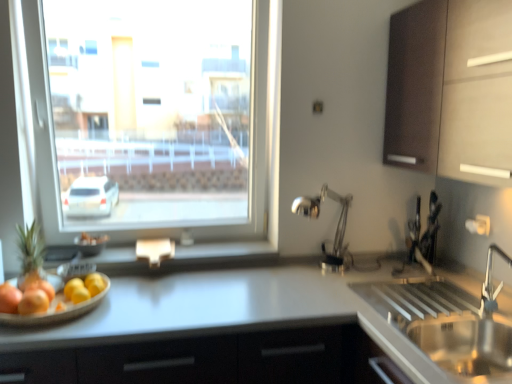
Locate an element on the screen. This screenshot has height=384, width=512. free space in front of yellow matte lemon at lower left, the 1th fruit positioned from the right is located at coordinates (61, 329).